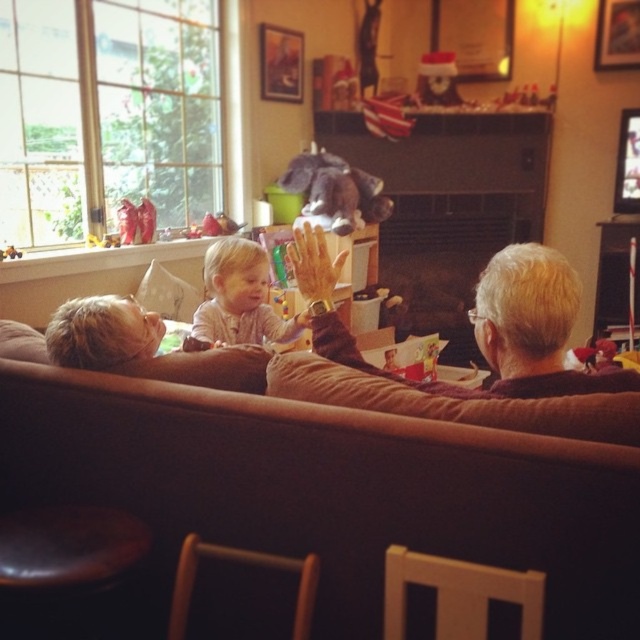
Who is positioned more to the left, gray fabric couch at center or wooden chair at lower center?

From the viewer's perspective, gray fabric couch at center appears more on the left side.

Can you confirm if gray fabric couch at center is positioned above wooden chair at lower center?

Yes, gray fabric couch at center is above wooden chair at lower center.

Between point (545, 381) and point (483, 580), which one is positioned behind?

Positioned behind is point (545, 381).

You are a GUI agent. You are given a task and a screenshot of the screen. Output one action in this format:
    pyautogui.click(x=<x>, y=<y>)
    Task: Click on the gray fabric couch at center
    Image resolution: width=640 pixels, height=640 pixels.
    Given the screenshot: What is the action you would take?
    pyautogui.click(x=476, y=323)

Based on the photo, is gray fabric couch at center bigger than santa hat plush at upper center?

Yes.

Between point (508, 376) and point (420, 97), which one is positioned behind?

The point (420, 97) is more distant.

The image size is (640, 640). Identify the location of gray fabric couch at center. (476, 323).

Between point (525, 621) and point (266, 320), which one is positioned in front?

Point (525, 621)

Is point (456, 596) behind point (224, 301)?

No, it is in front of (224, 301).

Locate an element on the screen. Image resolution: width=640 pixels, height=640 pixels. wooden chair at lower center is located at coordinates (460, 595).